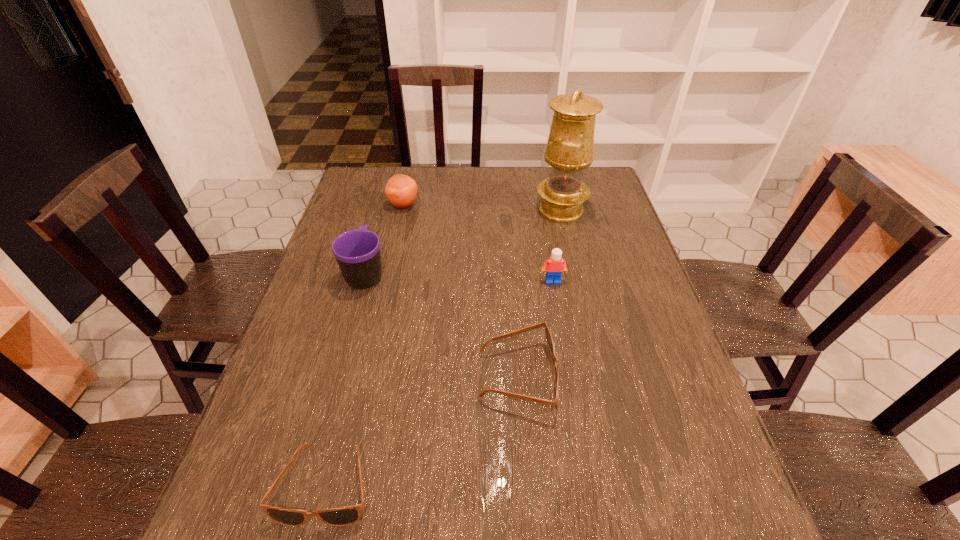
Considering the uniform spacing of sunglassess, where should an additional sunglasses be positioned on the right? Please locate a free spot. Please provide its 2D coordinates. Your answer should be formatted as a tuple, i.e. [(x, y)], where the tuple contains the x and y coordinates of a point satisfying the conditions above.

[(652, 300)]